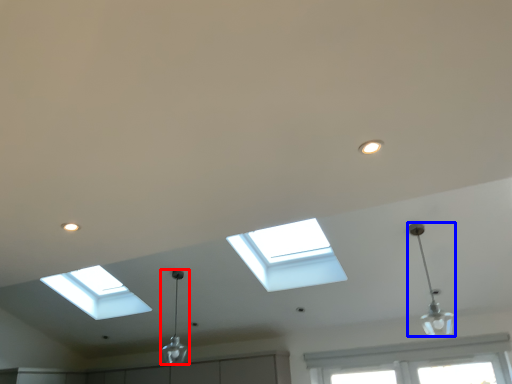
Question: Among these objects, which one is farthest to the camera, lamp (highlighted by a red box) or lamp (highlighted by a blue box)?

Choices:
 (A) lamp
 (B) lamp

Answer: (A)